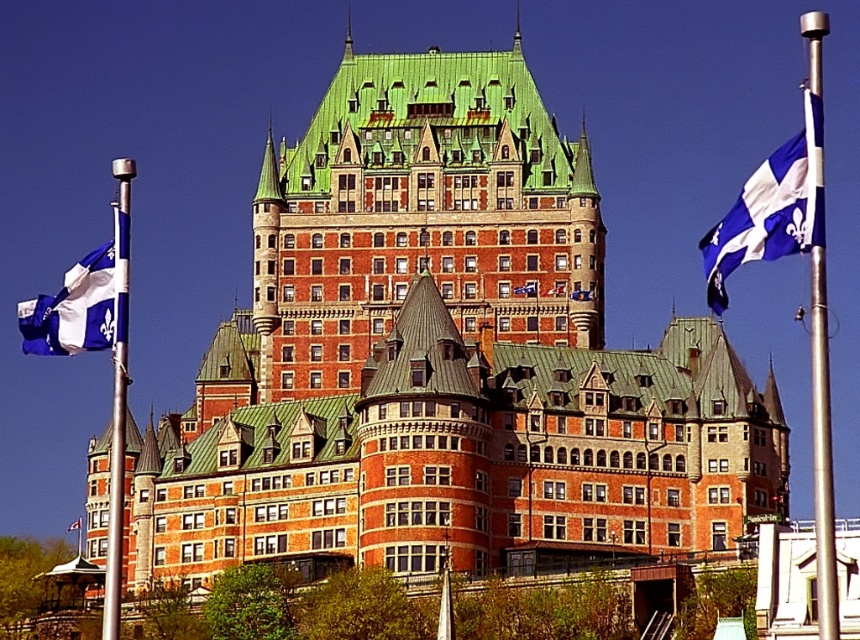
Can you confirm if blue and white fabric flag at right is bigger than blue and white fabric flag at left?

Yes.

Does point (779, 209) come closer to viewer compared to point (80, 298)?

Yes.

Where is `blue and white fabric flag at right`? This screenshot has height=640, width=860. blue and white fabric flag at right is located at coordinates (771, 209).

Does green shingled roof at center appear under blue and white fabric flag at left?

No, green shingled roof at center is not below blue and white fabric flag at left.

In order to click on green shingled roof at center in this screenshot , I will do tap(421, 216).

Does blue and white fabric flag at left have a lesser width compared to blue fabric flag at upper left?

No.

Locate an element on the screen. Image resolution: width=860 pixels, height=640 pixels. blue and white fabric flag at left is located at coordinates (77, 308).

This screenshot has width=860, height=640. I want to click on blue and white fabric flag at left, so click(77, 308).